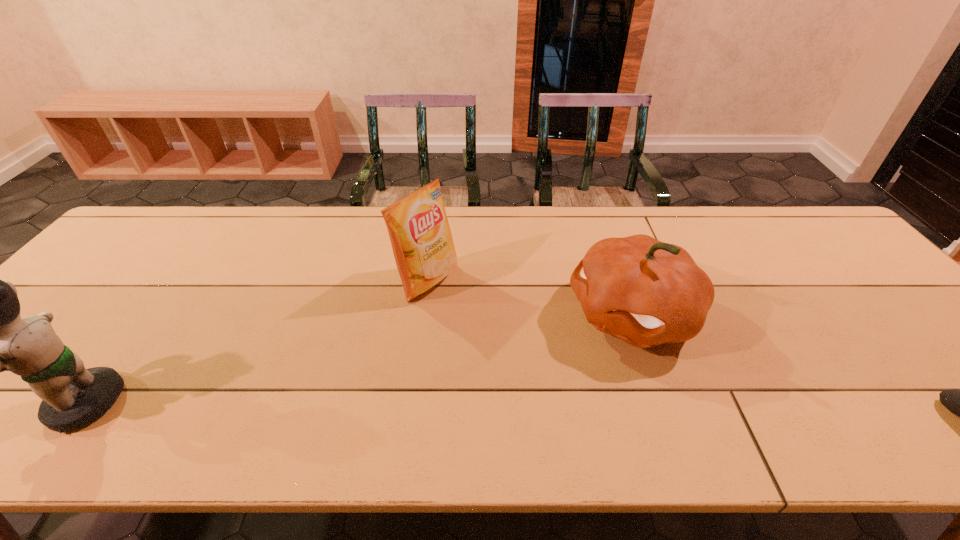
I want to click on the tallest object, so click(x=72, y=396).

Image resolution: width=960 pixels, height=540 pixels. I want to click on the leftmost object, so click(x=72, y=396).

The height and width of the screenshot is (540, 960). Identify the location of the second object from right to left. (646, 292).

Identify the location of the second object from left to right. The width and height of the screenshot is (960, 540). (x=419, y=231).

Locate an element on the screen. The width and height of the screenshot is (960, 540). free space located on the front face of the pumpkin is located at coordinates (544, 365).

Locate an element on the screen. This screenshot has width=960, height=540. vacant point located 0.260m on the front face of the pumpkin is located at coordinates (493, 395).

The height and width of the screenshot is (540, 960). In order to click on vacant space situated on the front face of the pumpkin in this screenshot , I will do `click(558, 357)`.

In order to click on blank space located on the front-facing side of the crisp (potato chip) in this screenshot , I will do `click(536, 344)`.

I want to click on vacant position located 0.050m on the front-facing side of the crisp (potato chip), so click(465, 302).

Image resolution: width=960 pixels, height=540 pixels. Find the location of `free region located on the front-facing side of the crisp (potato chip)`. free region located on the front-facing side of the crisp (potato chip) is located at coordinates (502, 324).